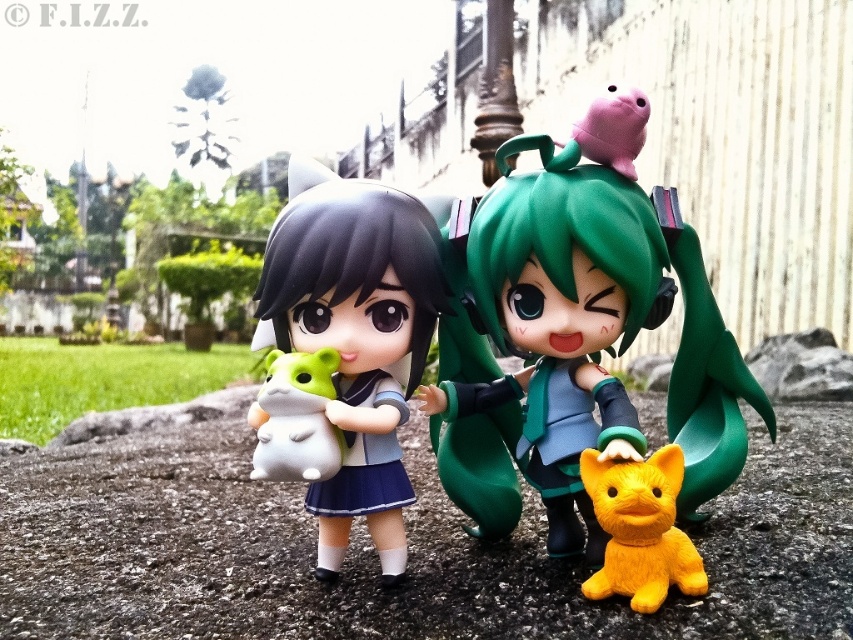
You are a collector who wants to display the green matte doll at center and the yellow rubber cat at lower right on a shelf. Which object should you place first to ensure both fit properly?

The green matte doll at center is much taller than the yellow rubber cat at lower right, so you should place the green matte doll at center first to ensure there is enough vertical space for both objects.

You are a collector who wants to place a new 3.5 inch wide collectible between the satin white plush at center and the white matte plush toy at left. Can you fit it there without overlapping either?

The distance between the satin white plush at center and the white matte plush toy at left is 3.19 inches. Since the new collectible is 3.5 inches wide, it is slightly wider than the available space, so it would overlap both items.